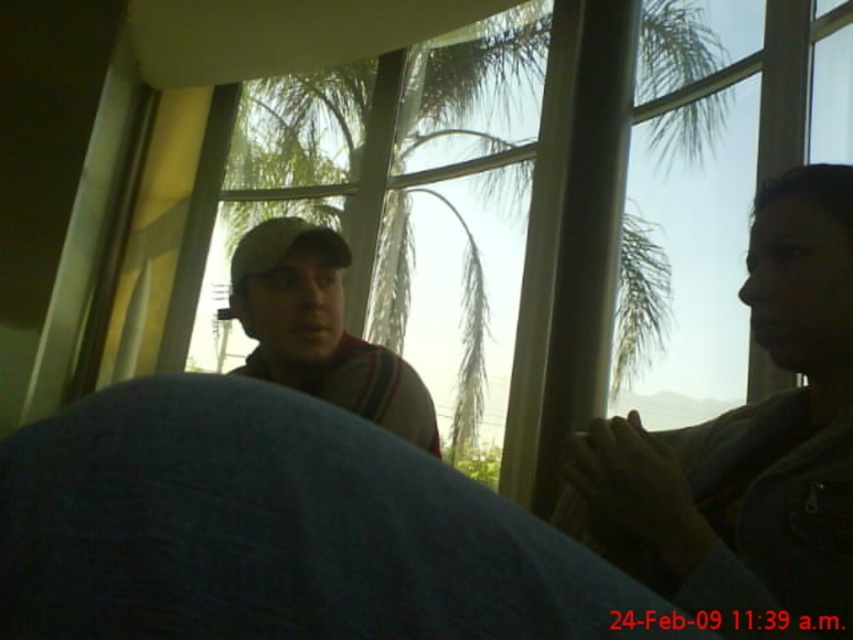
Is denim jacket at right shorter than matte beige cap at center?

No.

Is point (793, 512) closer to camera compared to point (293, 298)?

Yes, point (793, 512) is in front of point (293, 298).

Who is more distant from viewer, (759, 333) or (332, 280)?

Positioned behind is point (332, 280).

Where is `denim jacket at right`? This screenshot has width=853, height=640. denim jacket at right is located at coordinates (747, 444).